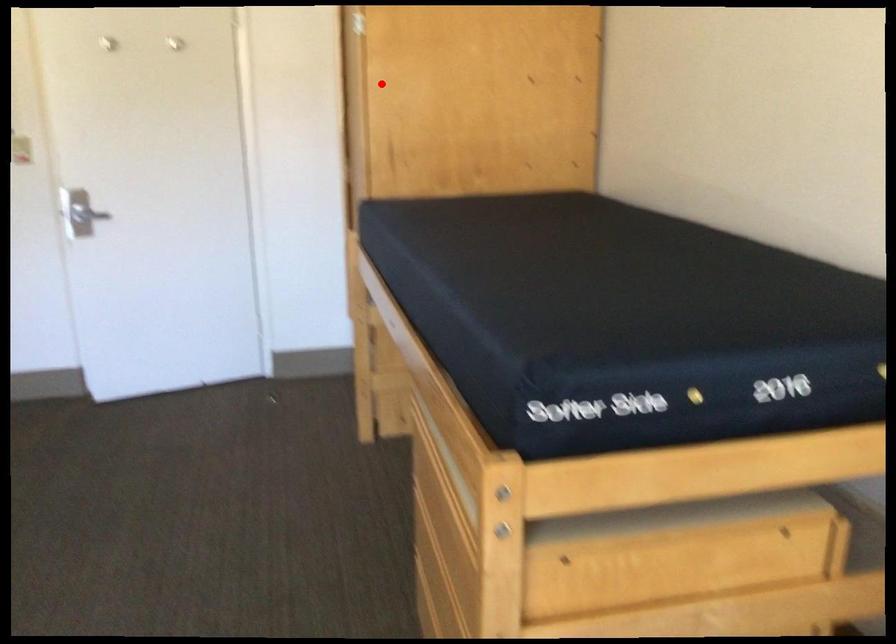
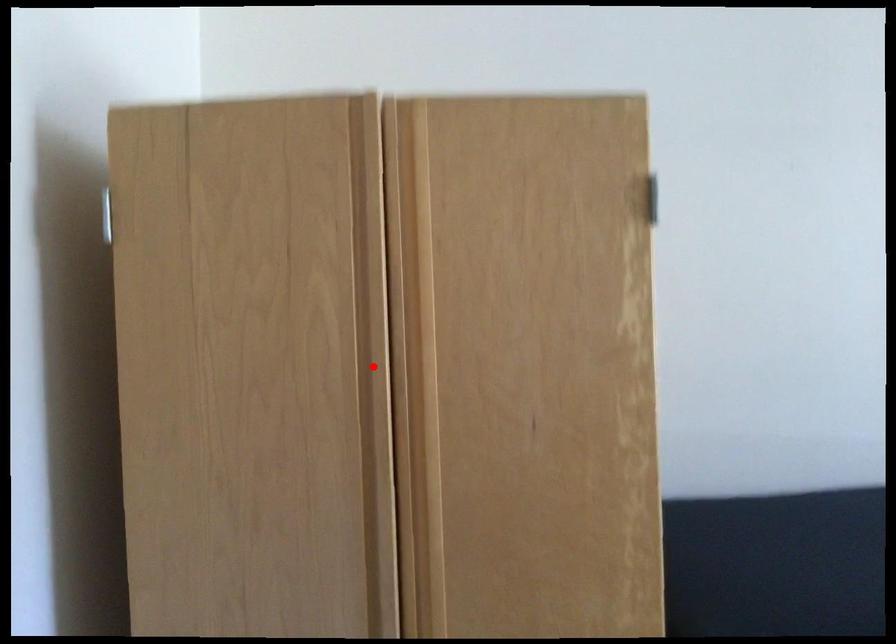
I am providing you with two images of the same scene from different viewpoints. A red point is marked on the first image and another point is marked on the second image. Is the marked point in image1 the same physical position as the marked point in image2?

No